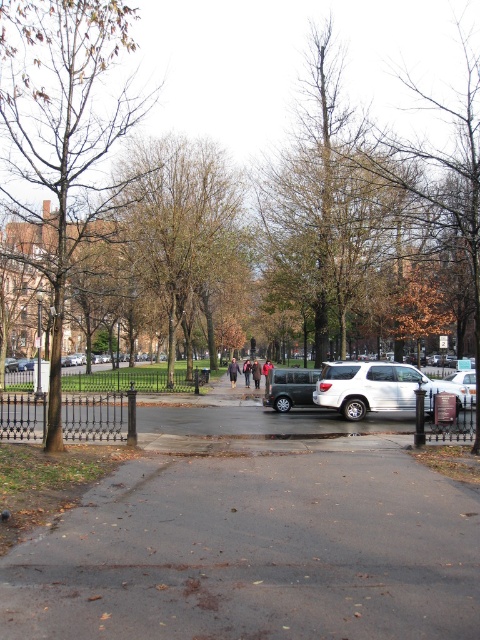
Question: Which point is farther from the camera taking this photo?

Choices:
 (A) (264, 376)
 (B) (247, 376)
 (C) (407, 387)

Answer: (A)

Question: Does dark brown leather jacket at center appear on the right side of dark blue jeans at center?

Choices:
 (A) no
 (B) yes

Answer: (B)

Question: Is white matte suv at center thinner than dark brown leather jacket at center?

Choices:
 (A) no
 (B) yes

Answer: (A)

Question: Which of these objects is positioned closest to the dark brown leather coat at center?

Choices:
 (A) dark blue jeans at center
 (B) dark brown leather jacket at center
 (C) brown leafy tree at left

Answer: (B)

Question: Where is matte black van at center located in relation to dark gray jacket at center in the image?

Choices:
 (A) right
 (B) left

Answer: (A)

Question: Which is nearer to the dark asphalt pavement at center?

Choices:
 (A) dark blue jacket at center
 (B) bare branches at center
 (C) dark gray jacket at center
 (D) brown leafy tree at left

Answer: (D)